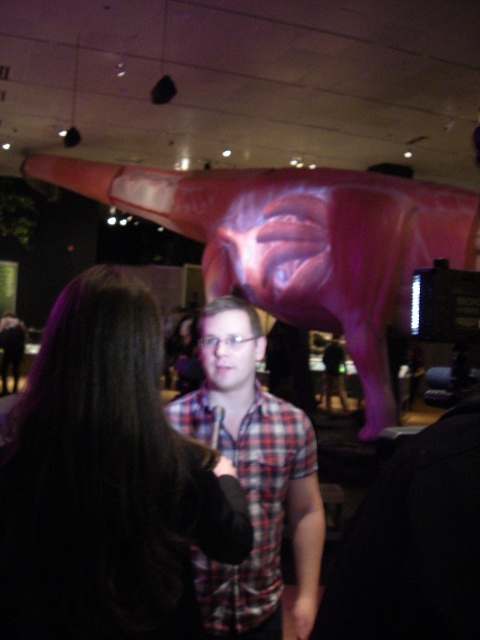
The height and width of the screenshot is (640, 480). In order to click on glossy pink statue at upper center in this screenshot , I will do `click(300, 243)`.

Does point (425, 202) lie behind point (267, 419)?

Yes.

Is point (190, 182) positioned in front of point (239, 332)?

No, it is not.

Locate an element on the screen. glossy pink statue at upper center is located at coordinates (300, 243).

Is dark brown hair at center below plaid shirt at center?

Incorrect, dark brown hair at center is not positioned below plaid shirt at center.

Which is below, dark brown hair at center or plaid shirt at center?

plaid shirt at center is lower down.

Where is `dark brown hair at center`? This screenshot has width=480, height=640. dark brown hair at center is located at coordinates (107, 481).

Does dark brown hair at center have a lesser width compared to glossy pink statue at upper center?

Yes.

Who is shorter, dark brown hair at center or glossy pink statue at upper center?

Standing shorter between the two is dark brown hair at center.

Identify the location of dark brown hair at center. (107, 481).